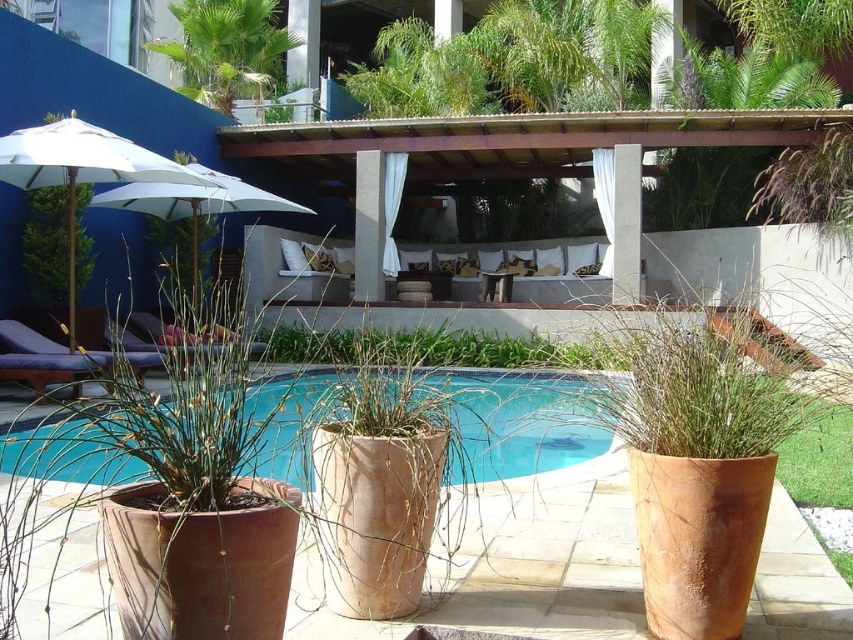
Can you confirm if matte white lounge at lower left is positioned below white fabric umbrella at upper left?

No.

This screenshot has width=853, height=640. What do you see at coordinates (144, 116) in the screenshot?
I see `matte white lounge at lower left` at bounding box center [144, 116].

Does point (3, 196) come behind point (193, 170)?

No.

The height and width of the screenshot is (640, 853). I want to click on matte white lounge at lower left, so click(x=144, y=116).

Is point (440, 161) behind point (567, 444)?

That is True.

Is matte white lounge at lower left smaller than blue ceramic swimming pool at center?

Correct, matte white lounge at lower left occupies less space than blue ceramic swimming pool at center.

The width and height of the screenshot is (853, 640). In order to click on matte white lounge at lower left in this screenshot , I will do `click(144, 116)`.

Is blue ceramic swimming pool at center shorter than white fabric umbrella at left?

Yes.

At what (x,y) coordinates should I click in order to perform the action: click on blue ceramic swimming pool at center. Please return your answer as a coordinate pair (x, y). The image size is (853, 640). Looking at the image, I should click on (515, 422).